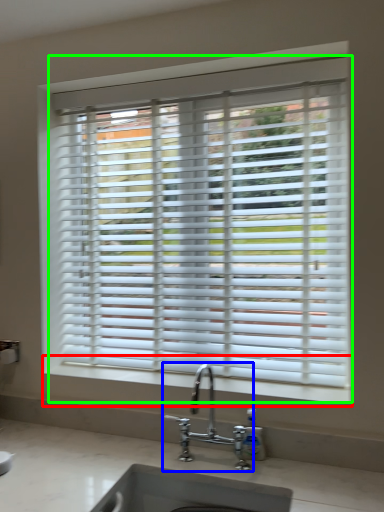
Question: Which object is the closest to the window sill (highlighted by a red box)? Choose among these: tap (highlighted by a blue box) or window blind (highlighted by a green box).

Choices:
 (A) tap
 (B) window blind

Answer: (A)